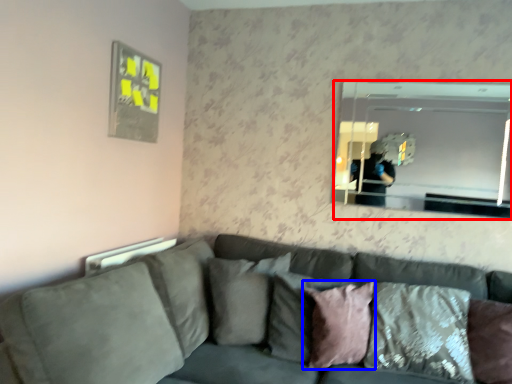
Question: Which object is closer to the camera taking this photo, mirror (highlighted by a red box) or pillow (highlighted by a blue box)?

Choices:
 (A) mirror
 (B) pillow

Answer: (B)